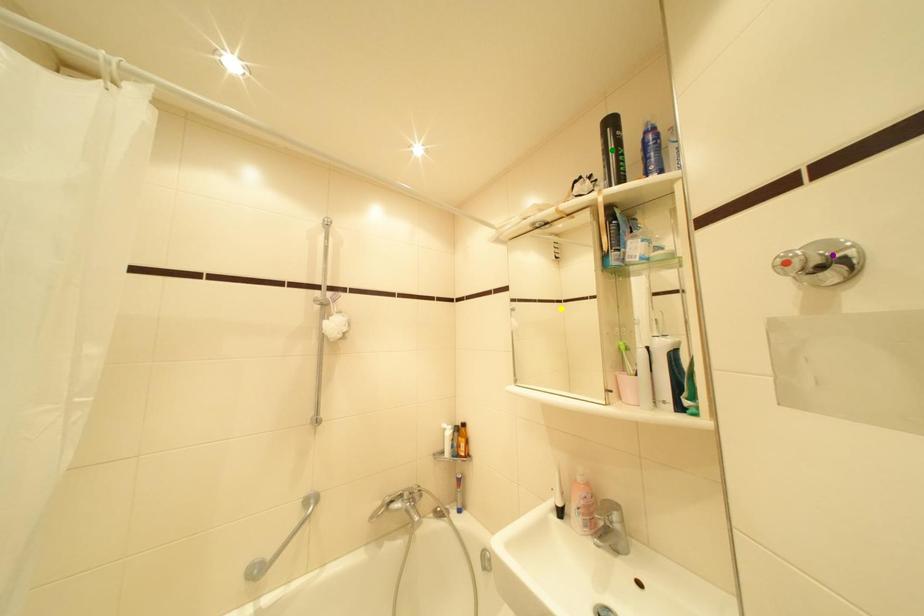
Order these from nearest to farthest:
yellow point
green point
purple point

purple point
green point
yellow point